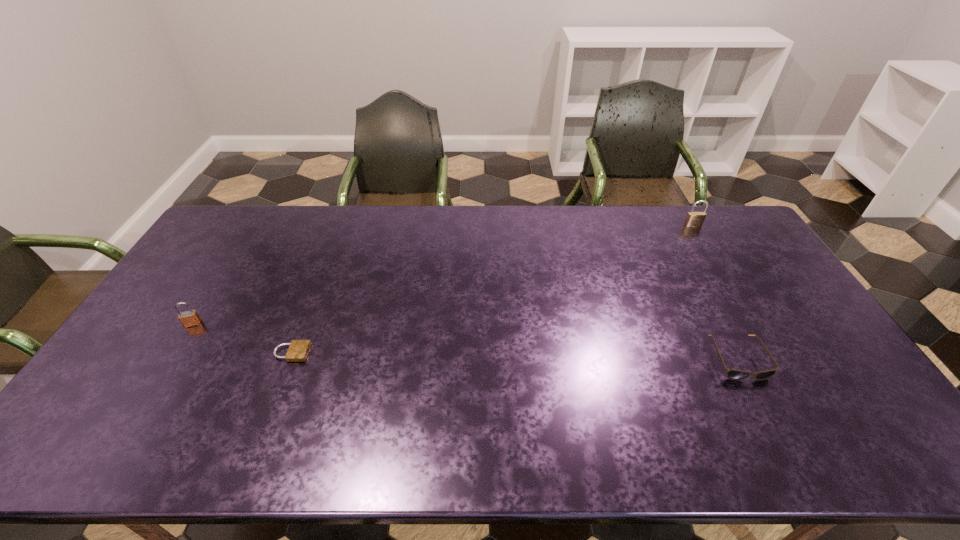
Select which object is the closest to the second farthest padlock. Please provide its 2D coordinates. Your answer should be formatted as a tuple, i.e. [(x, y)], where the tuple contains the x and y coordinates of a point satisfying the conditions above.

[(298, 350)]

In order to click on object that is the third closest one to the third tallest object in this screenshot , I will do `click(189, 318)`.

Choose which padlock is the nearest neighbor to the third object from right to left. Please provide its 2D coordinates. Your answer should be formatted as a tuple, i.e. [(x, y)], where the tuple contains the x and y coordinates of a point satisfying the conditions above.

[(189, 318)]

Identify which padlock is located as the nearest to the tallest padlock. Please provide its 2D coordinates. Your answer should be formatted as a tuple, i.e. [(x, y)], where the tuple contains the x and y coordinates of a point satisfying the conditions above.

[(298, 350)]

Where is `free space that satisfies the following two spatial constraints: 1. on the front-facing side of the tallest object; 2. on the keyhole side of the shortest padlock`? free space that satisfies the following two spatial constraints: 1. on the front-facing side of the tallest object; 2. on the keyhole side of the shortest padlock is located at coordinates (768, 353).

The height and width of the screenshot is (540, 960). In order to click on blank area in the image that satisfies the following two spatial constraints: 1. on the front-facing side of the tallest object; 2. on the keyhole side of the third object from right to left in this screenshot , I will do `click(768, 353)`.